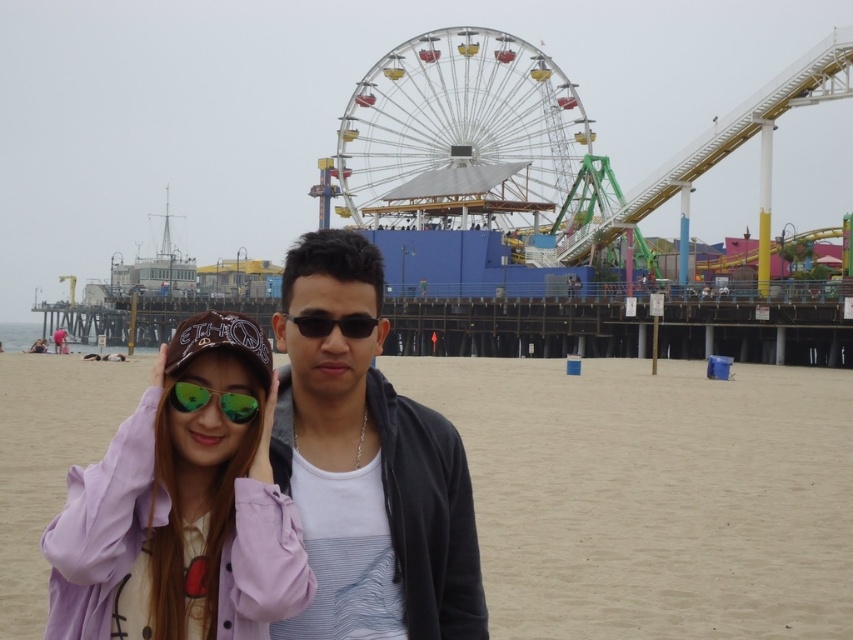
Question: Is black matte jacket at center wider than green reflective sunglasses at center?

Choices:
 (A) yes
 (B) no

Answer: (A)

Question: Can you confirm if green reflective sunglasses at center is smaller than black reflective sunglasses at center?

Choices:
 (A) no
 (B) yes

Answer: (B)

Question: Which of these objects is positioned closest to the beige sandy beach at lower center?

Choices:
 (A) purple fabric jacket at center
 (B) black matte jacket at center

Answer: (B)

Question: Among these points, which one is nearest to the camera?

Choices:
 (A) (294, 323)
 (B) (561, 420)

Answer: (A)

Question: Is metallic ferris wheel at upper center smaller than green reflective sunglasses at center?

Choices:
 (A) no
 (B) yes

Answer: (A)

Question: Which of the following is the closest to the observer?

Choices:
 (A) black reflective sunglasses at center
 (B) beige sandy beach at lower center
 (C) metallic ferris wheel at upper center
 (D) purple fabric jacket at center

Answer: (D)